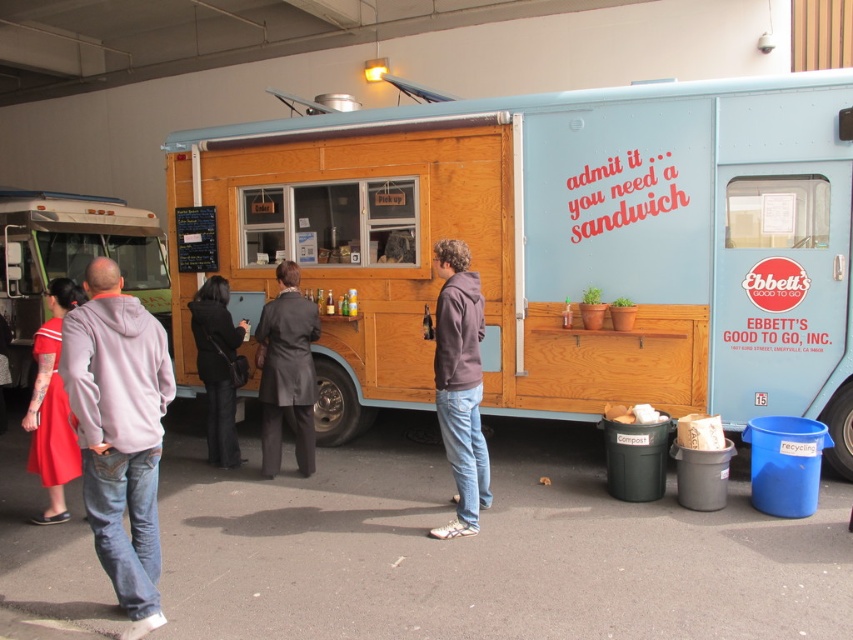
Who is positioned more to the right, wooden food truck at center or matte red dress at lower left?

wooden food truck at center

Describe the element at coordinates (561, 243) in the screenshot. This screenshot has width=853, height=640. I see `wooden food truck at center` at that location.

The height and width of the screenshot is (640, 853). I want to click on wooden food truck at center, so click(561, 243).

You are a GUI agent. You are given a task and a screenshot of the screen. Output one action in this format:
    pyautogui.click(x=<x>, y=<y>)
    Task: Click on the wooden food truck at center
    Image resolution: width=853 pixels, height=640 pixels.
    Given the screenshot: What is the action you would take?
    pyautogui.click(x=561, y=243)

Is point (476, 404) more distant than point (207, 308)?

No, (476, 404) is in front of (207, 308).

Does matte brown hoodie at center lie in front of black leather jacket at center?

Yes, matte brown hoodie at center is in front of black leather jacket at center.

Between point (474, 509) and point (190, 314), which one is positioned in front?

Positioned in front is point (474, 509).

Locate an element on the screen. This screenshot has height=640, width=853. matte brown hoodie at center is located at coordinates (460, 385).

Between point (62, 323) and point (448, 301), which one is positioned in front?

Point (62, 323)

Does point (94, 506) lie behind point (477, 394)?

No, it is not.

At what (x,y) coordinates should I click in order to perform the action: click on gray hoodie at center. Please return your answer as a coordinate pair (x, y). Looking at the image, I should click on (119, 433).